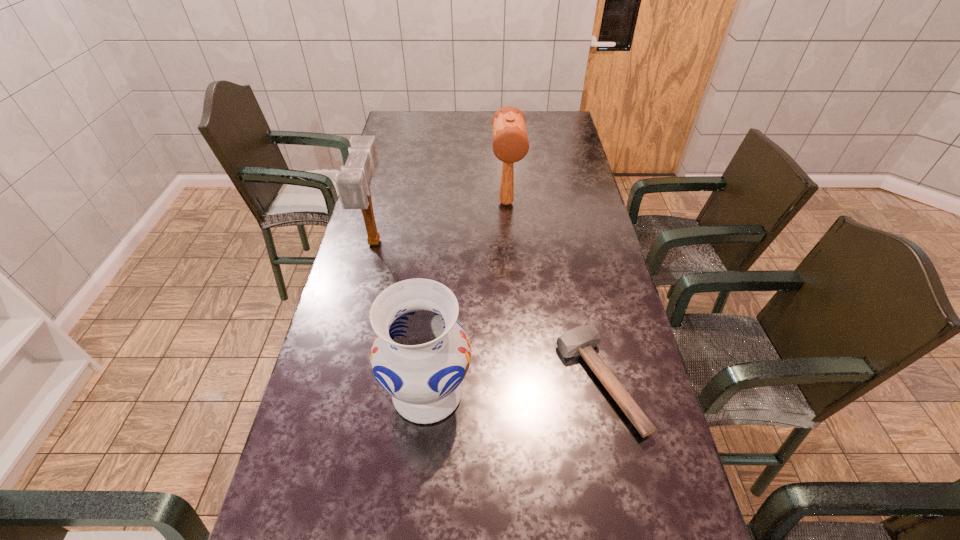
Where is `the second object from right to left`? The image size is (960, 540). the second object from right to left is located at coordinates (510, 144).

The height and width of the screenshot is (540, 960). In order to click on the leftmost object in this screenshot , I will do `click(353, 183)`.

At what (x,y) coordinates should I click in order to perform the action: click on vase. Please return your answer as a coordinate pair (x, y). The height and width of the screenshot is (540, 960). Looking at the image, I should click on (421, 354).

Locate an element on the screen. the rightmost object is located at coordinates (581, 340).

I want to click on the nearest mallet, so click(581, 340).

In order to click on free region located on the strike surface of the second mallet from right to left in this screenshot , I will do `click(513, 294)`.

This screenshot has height=540, width=960. What are the coordinates of `free space located on the front of the leftmost object` in the screenshot? It's located at (356, 316).

Find the location of `vacant space located 0.120m on the back of the vase`. vacant space located 0.120m on the back of the vase is located at coordinates (434, 320).

Find the location of a particular element. The height and width of the screenshot is (540, 960). free space located on the back of the shortest mallet is located at coordinates (574, 261).

Find the location of a particular element. The image size is (960, 540). object present at the left edge is located at coordinates (353, 183).